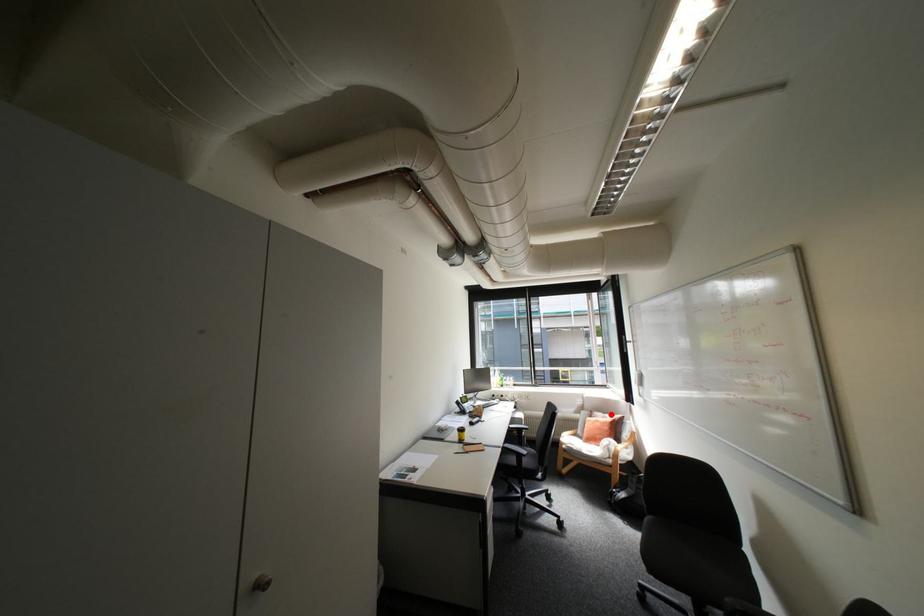
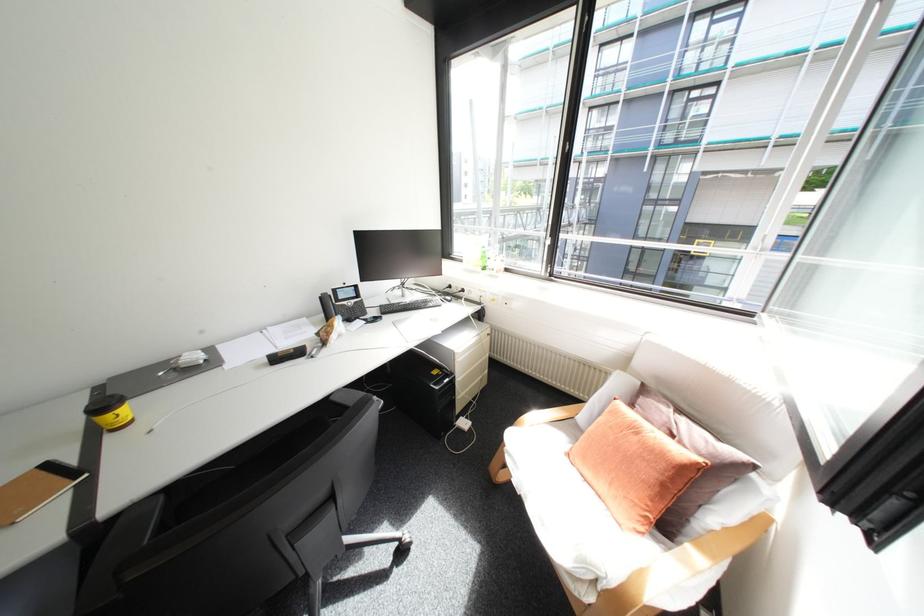
In the second image, find the point that corresponds to the highlighted location in the first image.

(677, 410)